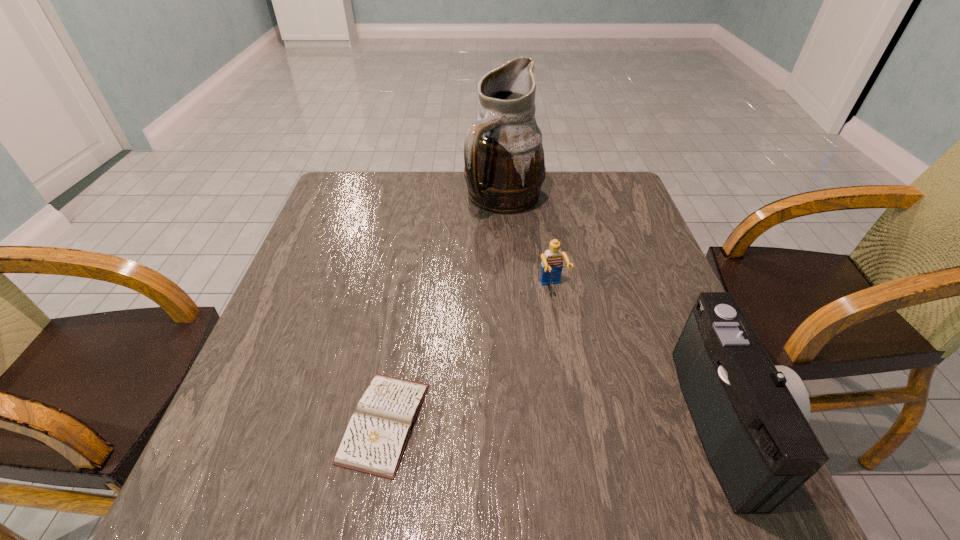
Find the location of a particular element. free space that is in between the shortest object and the pitcher is located at coordinates (444, 310).

At what (x,y) coordinates should I click in order to perform the action: click on vacant space in between the leftmost object and the tallest object. Please return your answer as a coordinate pair (x, y). The height and width of the screenshot is (540, 960). Looking at the image, I should click on (444, 310).

Locate an element on the screen. The width and height of the screenshot is (960, 540). vacant space that's between the diary and the tallest object is located at coordinates (444, 310).

At what (x,y) coordinates should I click in order to perform the action: click on unoccupied position between the rightmost object and the diary. Please return your answer as a coordinate pair (x, y). The width and height of the screenshot is (960, 540). Looking at the image, I should click on (556, 422).

Find the location of a particular element. This screenshot has height=540, width=960. free point between the third shortest object and the tallest object is located at coordinates (616, 310).

The height and width of the screenshot is (540, 960). Find the location of `empty space between the camcorder and the shortest object`. empty space between the camcorder and the shortest object is located at coordinates (556, 422).

The width and height of the screenshot is (960, 540). Find the location of `object that is the closest one to the pitcher`. object that is the closest one to the pitcher is located at coordinates (552, 260).

Where is `the third closest object to the tallest object`? The height and width of the screenshot is (540, 960). the third closest object to the tallest object is located at coordinates (376, 436).

Image resolution: width=960 pixels, height=540 pixels. I want to click on vacant position in the image that satisfies the following two spatial constraints: 1. on the front side of the rightmost object; 2. on the lens of the second shortest object, so click(576, 422).

At what (x,y) coordinates should I click in order to perform the action: click on vacant region that satisfies the following two spatial constraints: 1. on the front side of the second tallest object; 2. on the lens of the farthest object. Please return your answer as a coordinate pair (x, y). Image resolution: width=960 pixels, height=540 pixels. Looking at the image, I should click on [520, 422].